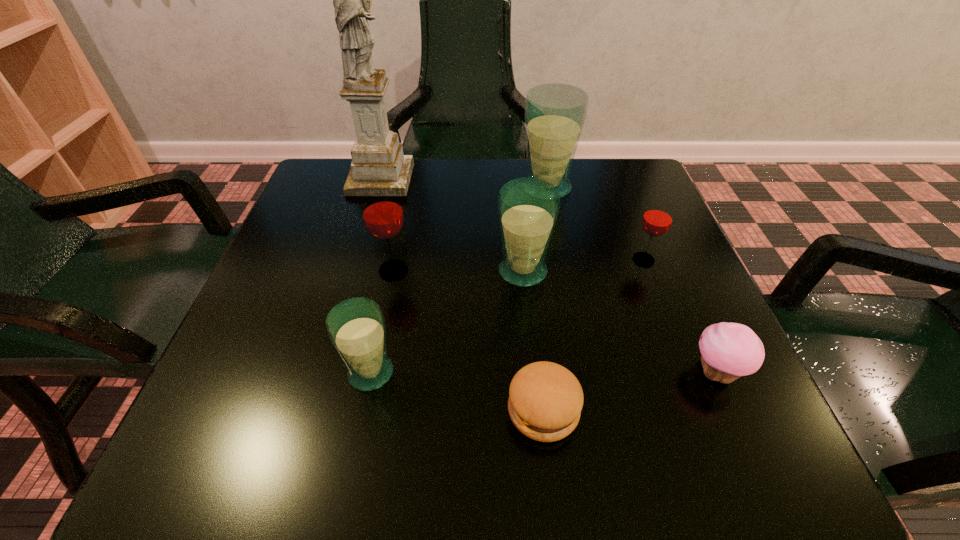
The width and height of the screenshot is (960, 540). In order to click on gray sculpture in this screenshot , I will do 377,156.

This screenshot has width=960, height=540. What are the coordinates of `sculpture` in the screenshot? It's located at (377, 156).

The image size is (960, 540). I want to click on the second tallest object, so click(555, 113).

This screenshot has height=540, width=960. Identify the location of the tallest glass. (555, 113).

Identify the location of the bigger red glass. (383, 216).

Where is `the second smallest blue glass`? This screenshot has width=960, height=540. the second smallest blue glass is located at coordinates (528, 207).

Where is `the right red glass`? the right red glass is located at coordinates (657, 219).

Where is `the smaller red glass`? This screenshot has width=960, height=540. the smaller red glass is located at coordinates (657, 219).

Where is `the leftmost blue glass`? the leftmost blue glass is located at coordinates coord(356,327).

Identify the location of the nearest glass. (356, 327).